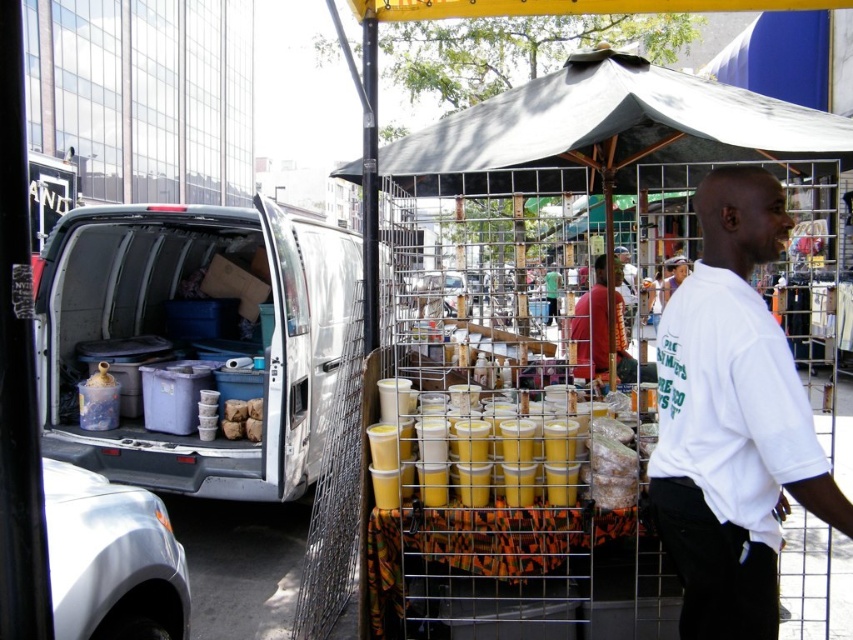
Question: Does matte plastic containers at rear have a greater width compared to orange fabric shirt at center?

Choices:
 (A) yes
 (B) no

Answer: (A)

Question: From the image, what is the correct spatial relationship of white cotton t-shirt at center in relation to yellow plastic cups at center?

Choices:
 (A) right
 (B) left

Answer: (A)

Question: Observing the image, what is the correct spatial positioning of white cotton t-shirt at center in reference to white t-shirt at center?

Choices:
 (A) right
 (B) left

Answer: (B)

Question: Which object appears farthest from the camera in this image?

Choices:
 (A) white t-shirt at center
 (B) orange fabric shirt at center
 (C) yellow plastic cups at center
 (D) white cotton t-shirt at center

Answer: (A)

Question: Which point appears farthest from the camera in this image?

Choices:
 (A) (654, 467)
 (B) (682, 256)
 (C) (556, 488)
 (D) (602, 260)

Answer: (B)

Question: Among these objects, which one is farthest from the camera?

Choices:
 (A) matte plastic containers at rear
 (B) white t-shirt at center
 (C) white cotton t-shirt at center
 (D) orange fabric shirt at center

Answer: (B)